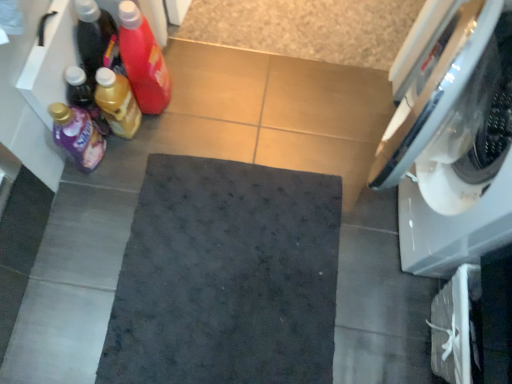
Question: Is translucent plastic bottle at left, the 2th bottle when ordered from right to left, surrounded by white glossy washing machine at right?

Choices:
 (A) no
 (B) yes

Answer: (A)

Question: Is white glossy washing machine at right oriented away from translucent plastic bottle at left, the third bottle when ordered from left to right?

Choices:
 (A) no
 (B) yes

Answer: (A)

Question: Considering the relative sizes of white glossy washing machine at right and translucent plastic bottle at left, the third bottle when ordered from left to right, in the image provided, is white glossy washing machine at right shorter than translucent plastic bottle at left, the third bottle when ordered from left to right,?

Choices:
 (A) yes
 (B) no

Answer: (B)

Question: Does white glossy washing machine at right have a larger size compared to translucent plastic bottle at left, the third bottle when ordered from left to right?

Choices:
 (A) no
 (B) yes

Answer: (B)

Question: Considering the relative positions of white glossy washing machine at right and translucent plastic bottle at left, the 2th bottle when ordered from right to left, in the image provided, is white glossy washing machine at right in front of translucent plastic bottle at left, the 2th bottle when ordered from right to left,?

Choices:
 (A) yes
 (B) no

Answer: (A)

Question: From the image's perspective, is translucent plastic bottle at left, positioned as the 1th bottle in right-to-left order, above or below translucent plastic bottle at left, the 2th bottle from the left?

Choices:
 (A) below
 (B) above

Answer: (B)

Question: Based on their positions, is translucent plastic bottle at left, positioned as the 1th bottle in right-to-left order, located to the left or right of translucent plastic bottle at left, the 3th bottle when ordered from right to left?

Choices:
 (A) right
 (B) left

Answer: (A)

Question: Would you say translucent plastic bottle at left, positioned as the 1th bottle in right-to-left order, is inside or outside translucent plastic bottle at left, the 3th bottle when ordered from right to left?

Choices:
 (A) inside
 (B) outside

Answer: (B)

Question: Relative to translucent plastic bottle at left, the 3th bottle when ordered from right to left, is translucent plastic bottle at left, positioned as the 1th bottle in right-to-left order, in front or behind?

Choices:
 (A) behind
 (B) front

Answer: (B)

Question: Is white glossy washing machine at right taller or shorter than translucent plastic bottle at left, the 3th bottle when ordered from right to left?

Choices:
 (A) tall
 (B) short

Answer: (A)

Question: Looking at their shapes, would you say white glossy washing machine at right is wider or thinner than translucent plastic bottle at left, the 2th bottle from the left?

Choices:
 (A) wide
 (B) thin

Answer: (A)

Question: Is white glossy washing machine at right situated inside translucent plastic bottle at left, the 3th bottle when ordered from right to left, or outside?

Choices:
 (A) outside
 (B) inside

Answer: (A)

Question: Considering their positions, is white glossy washing machine at right located in front of or behind translucent plastic bottle at left, the 3th bottle when ordered from right to left?

Choices:
 (A) behind
 (B) front

Answer: (B)

Question: In terms of height, does dark matte bath mat at center look taller or shorter compared to translucent plastic bottle at left, the 3th bottle when ordered from right to left?

Choices:
 (A) short
 (B) tall

Answer: (A)

Question: Does point (282, 294) appear closer or farther from the camera than point (105, 127)?

Choices:
 (A) closer
 (B) farther

Answer: (A)